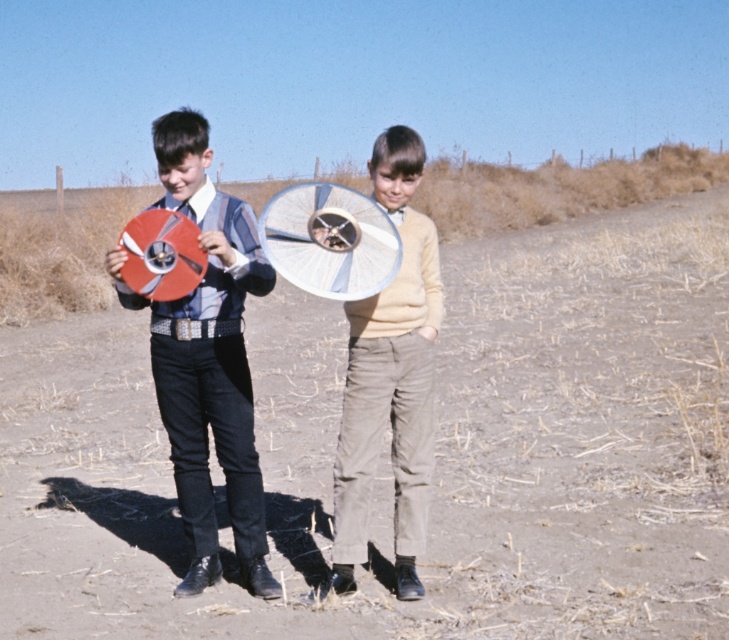
Does point (300, 364) come farther from viewer compared to point (157, 340)?

That is True.

Does dull brown dirt at center come behind matte plastic disc at left?

That is False.

Does point (50, 625) come in front of point (171, 144)?

No, (50, 625) is behind (171, 144).

Find the location of a particular element. dull brown dirt at center is located at coordinates (389, 452).

Which is behind, point (238, 429) or point (421, 544)?

The point (238, 429) is more distant.

Looking at this image, is matte plastic disc at left wider than light beige corduroy pants at center?

Yes.

Describe the element at coordinates (208, 362) in the screenshot. The image size is (729, 640). I see `matte plastic disc at left` at that location.

Find the location of a particular element. Image resolution: width=729 pixels, height=640 pixels. matte plastic disc at left is located at coordinates (208, 362).

The width and height of the screenshot is (729, 640). In order to click on dull brown dirt at center in this screenshot , I will do `click(389, 452)`.

Which is above, dull brown dirt at center or light beige corduroy pants at center?

dull brown dirt at center

Between point (440, 342) and point (408, 307), which one is positioned behind?

The point (440, 342) is behind.

This screenshot has width=729, height=640. I want to click on dull brown dirt at center, so click(389, 452).